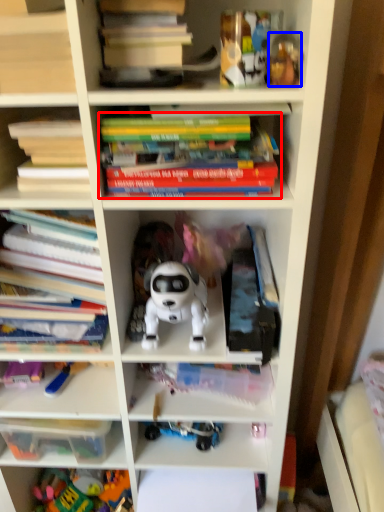
Question: Which of the following is the farthest to the observer, book (highlighted by a red box) or toy (highlighted by a blue box)?

Choices:
 (A) book
 (B) toy

Answer: (A)